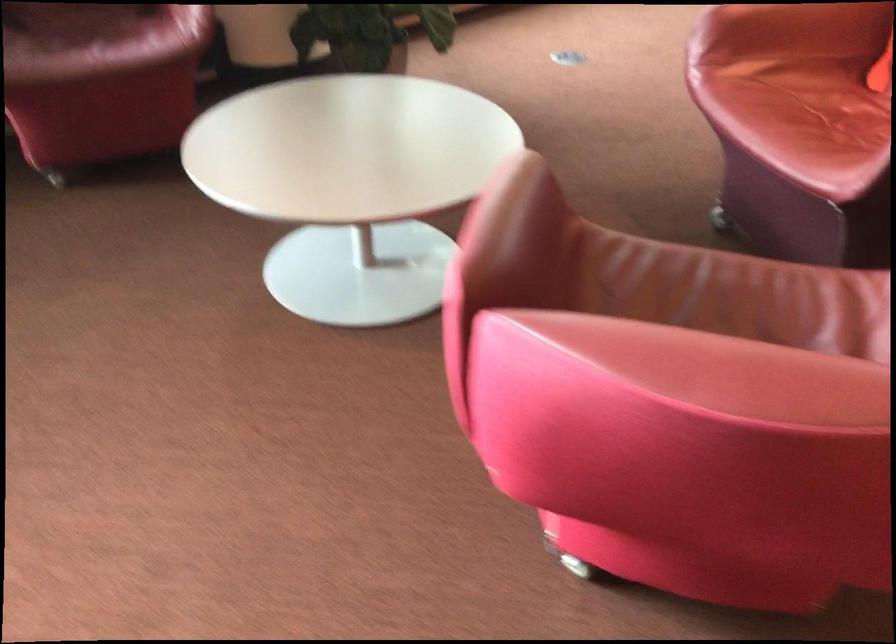
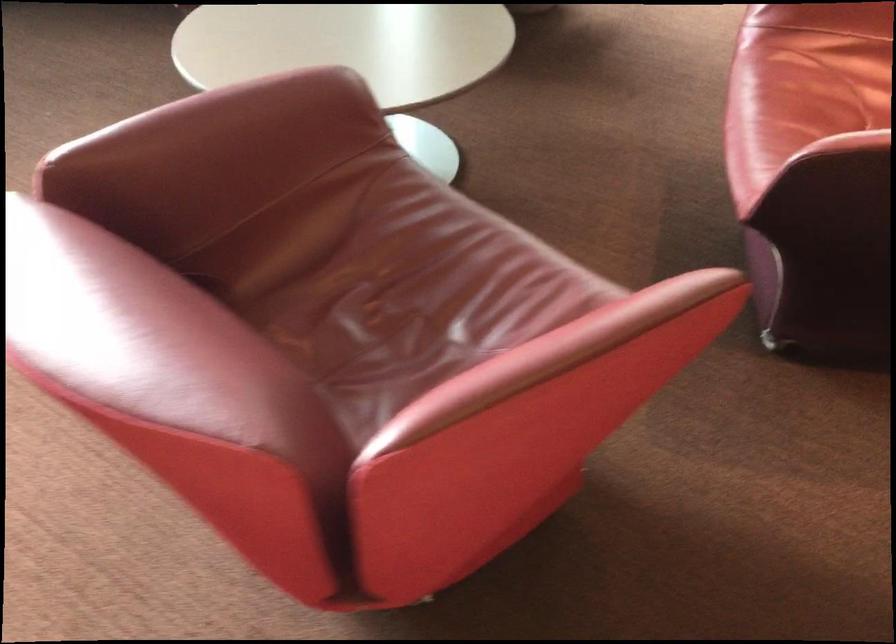
Where in the second image is the point corresponding to (535,200) from the first image?

(255, 118)